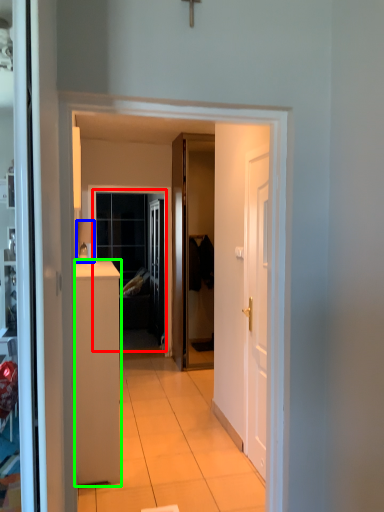
Question: Which object is positioned farthest from window (highlighted by a red box)? Select from lamp (highlighted by a blue box) and cabinetry (highlighted by a green box).

Choices:
 (A) lamp
 (B) cabinetry

Answer: (B)